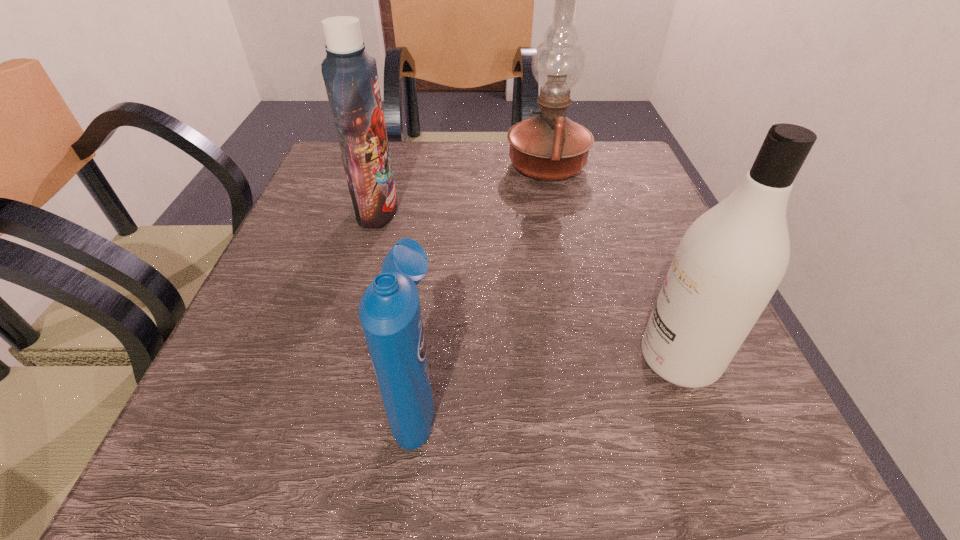
You are a GUI agent. You are given a task and a screenshot of the screen. Output one action in this format:
    pyautogui.click(x=<x>, y=<y>)
    Task: Click on the vacant space at the far edge of the desktop
    
    Given the screenshot: What is the action you would take?
    pyautogui.click(x=509, y=191)

The width and height of the screenshot is (960, 540). Find the location of `vacant area at the near edge`. vacant area at the near edge is located at coordinates (627, 493).

The height and width of the screenshot is (540, 960). I want to click on vacant space at the left edge of the desktop, so (320, 196).

At what (x,y) coordinates should I click in order to perform the action: click on vacant space at the right edge of the desktop. Please return your answer as a coordinate pair (x, y). Image resolution: width=960 pixels, height=540 pixels. Looking at the image, I should click on (611, 239).

This screenshot has width=960, height=540. In order to click on vacant area at the far left corner in this screenshot , I will do coord(327,163).

In the image, there is a desktop. At what (x,y) coordinates should I click in order to perform the action: click on free region at the far right corner. Please return your answer as a coordinate pair (x, y). The width and height of the screenshot is (960, 540). Looking at the image, I should click on (622, 178).

You are a GUI agent. You are given a task and a screenshot of the screen. Output one action in this format:
    pyautogui.click(x=<x>, y=<y>)
    Task: Click on the vacant space at the near right corner
    
    Given the screenshot: What is the action you would take?
    pyautogui.click(x=691, y=469)

This screenshot has width=960, height=540. Identify the location of vacant area that lies between the shortest shampoo and the oil lamp. (482, 282).

The height and width of the screenshot is (540, 960). In order to click on vacant area that lies between the oil lamp and the leftmost object in this screenshot , I will do `click(462, 188)`.

This screenshot has height=540, width=960. I want to click on free space between the leftmost shampoo and the oil lamp, so click(x=462, y=188).